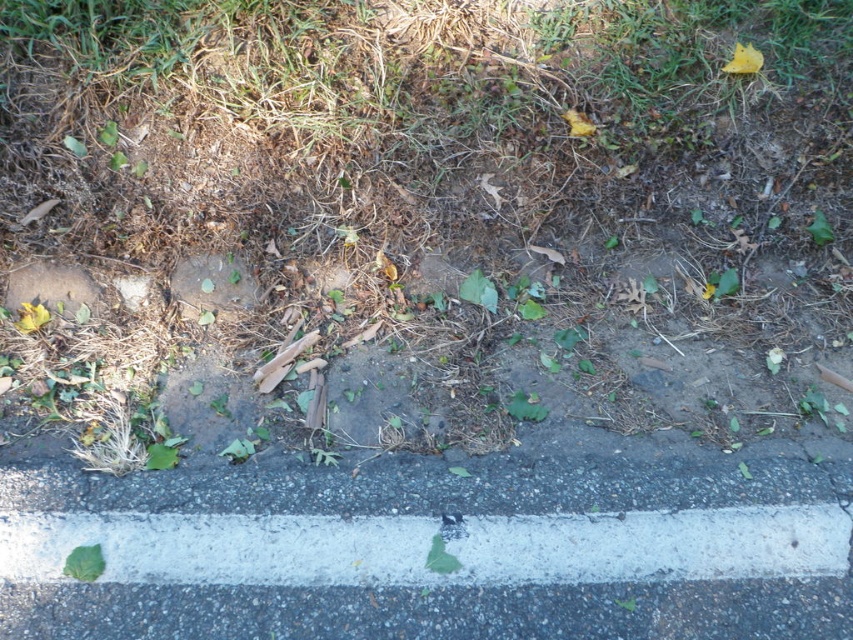
Which of these two, green leafy grass at center or green leafy at lower left, stands taller?

Standing taller between the two is green leafy grass at center.

The width and height of the screenshot is (853, 640). What do you see at coordinates (426, 211) in the screenshot?
I see `green leafy grass at center` at bounding box center [426, 211].

The height and width of the screenshot is (640, 853). What do you see at coordinates (426, 211) in the screenshot? I see `green leafy grass at center` at bounding box center [426, 211].

You are a GUI agent. You are given a task and a screenshot of the screen. Output one action in this format:
    pyautogui.click(x=<x>, y=<y>)
    Task: Click on the green leafy grass at center
    The height and width of the screenshot is (640, 853).
    Given the screenshot: What is the action you would take?
    pyautogui.click(x=426, y=211)

Between green leafy grass at center and green leafy weed at lower center, which one has more height?

With more height is green leafy grass at center.

Between green leafy grass at center and green leafy weed at lower center, which one is positioned lower?

Positioned lower is green leafy weed at lower center.

Is point (548, 221) closer to camera compared to point (445, 561)?

No, it is not.

Image resolution: width=853 pixels, height=640 pixels. I want to click on green leafy grass at center, so click(426, 211).

Can you confirm if green leafy grass at center is taller than white painted curb at lower center?

Indeed, green leafy grass at center has a greater height compared to white painted curb at lower center.

Is green leafy grass at center smaller than white painted curb at lower center?

Incorrect, green leafy grass at center is not smaller in size than white painted curb at lower center.

Locate an element on the screen. This screenshot has height=640, width=853. green leafy grass at center is located at coordinates (426, 211).